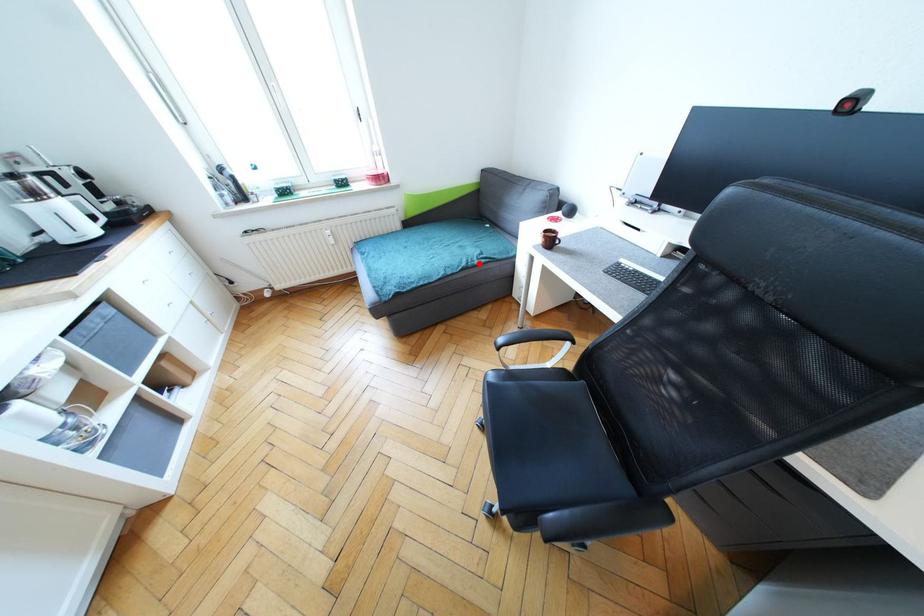
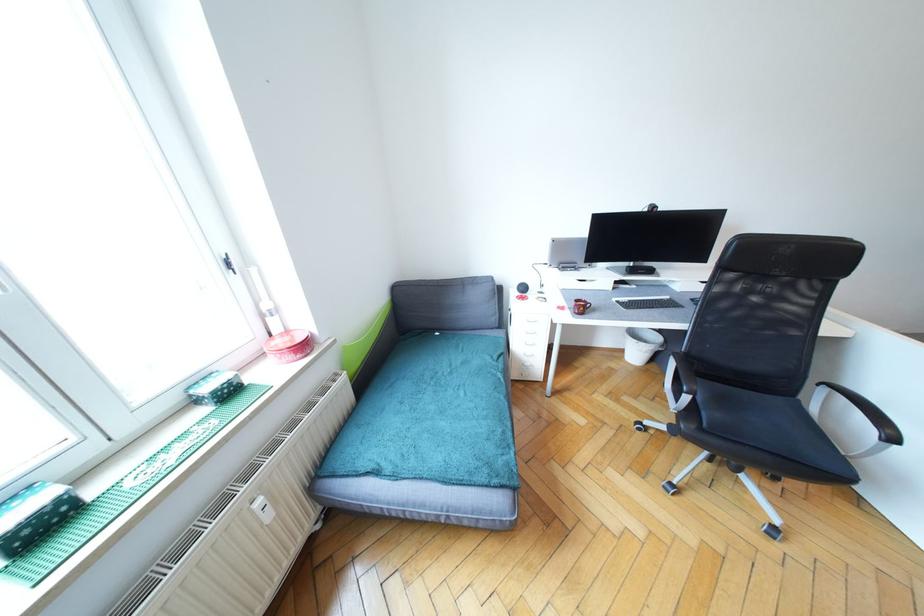
The point at the highlighted location is marked in the first image. Where is the corresponding point in the second image?

(504, 367)